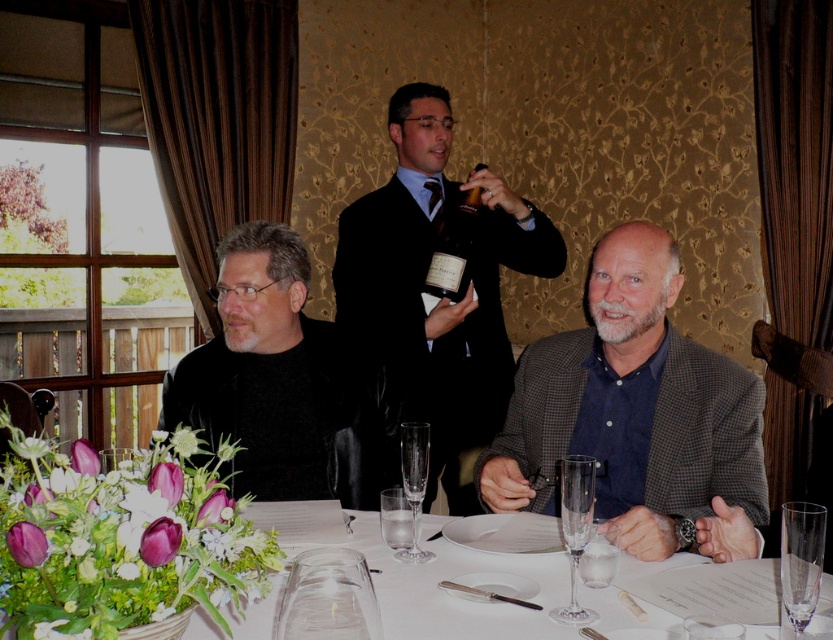
Between point (465, 442) and point (452, 216), which one is positioned behind?

The point (465, 442) is more distant.

This screenshot has width=833, height=640. Identify the location of shiny black suit at center. (427, 300).

Is point (472, 305) positioned after point (470, 189)?

No, (472, 305) is in front of (470, 189).

Where is `shiny black suit at center`? This screenshot has height=640, width=833. shiny black suit at center is located at coordinates (427, 300).

Is point (816, 531) in front of point (592, 616)?

Yes.

Is transparent glass at lower right further to the viewer compared to clear glass wine glass at lower center?

No, transparent glass at lower right is closer to the viewer.

Image resolution: width=833 pixels, height=640 pixels. In order to click on transparent glass at lower right in this screenshot , I will do `click(801, 563)`.

Where is `transparent glass at lower right`? transparent glass at lower right is located at coordinates (801, 563).

Who is positioned more to the right, gray checkered blazer at lower right or white porcelain vase at lower left?

From the viewer's perspective, gray checkered blazer at lower right appears more on the right side.

Is gray checkered blazer at lower right shorter than white porcelain vase at lower left?

Incorrect, gray checkered blazer at lower right's height does not fall short of white porcelain vase at lower left's.

Does point (729, 508) lie behind point (358, 528)?

No, it is not.

Find the location of a particular element. This screenshot has height=640, width=833. gray checkered blazer at lower right is located at coordinates (649, 410).